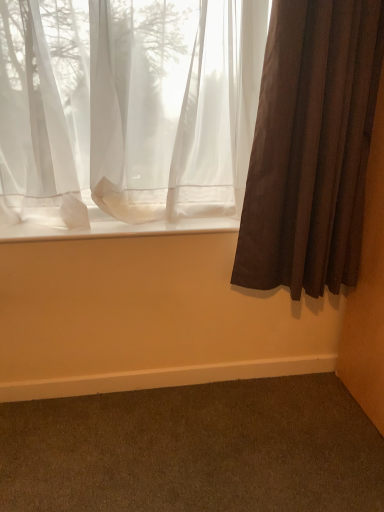
Question: Is sheer white curtain at upper left, positioned as the 2th curtain in right-to-left order, wider or thinner than white sheer fabric at lower center?

Choices:
 (A) thin
 (B) wide

Answer: (A)

Question: Is sheer white curtain at upper left, the 1th curtain in the left-to-right sequence, inside or outside of white sheer fabric at lower center?

Choices:
 (A) outside
 (B) inside

Answer: (A)

Question: Estimate the real-world distances between objects in this image. Which object is closer to the dark brown carpet at lower right?

Choices:
 (A) white sheer fabric at lower center
 (B) brown textured curtain at right, which is the first curtain from right to left
 (C) sheer white curtain at upper left, the 1th curtain in the left-to-right sequence

Answer: (A)

Question: Considering the real-world distances, which object is closest to the brown textured curtain at right, the 2th curtain positioned from the left?

Choices:
 (A) dark brown carpet at lower right
 (B) white sheer fabric at lower center
 (C) sheer white curtain at upper left, positioned as the 2th curtain in right-to-left order

Answer: (C)